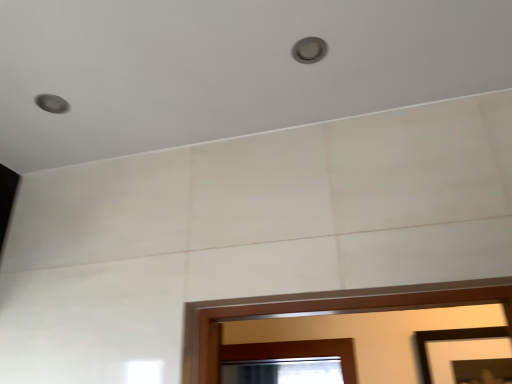
Question: Can you confirm if black matte picture frame at lower right is thinner than matte silver light at upper center?

Choices:
 (A) no
 (B) yes

Answer: (B)

Question: Is black matte picture frame at lower right facing away from matte silver light at upper center?

Choices:
 (A) yes
 (B) no

Answer: (B)

Question: Is black matte picture frame at lower right placed right next to matte silver light at upper center?

Choices:
 (A) no
 (B) yes

Answer: (A)

Question: Is black matte picture frame at lower right facing towards matte silver light at upper center?

Choices:
 (A) yes
 (B) no

Answer: (A)

Question: Does black matte picture frame at lower right lie behind matte silver light at upper center?

Choices:
 (A) yes
 (B) no

Answer: (A)

Question: From the image's perspective, is black matte picture frame at lower right under matte silver light at upper center?

Choices:
 (A) yes
 (B) no

Answer: (A)

Question: Considering the relative sizes of matte silver light at upper center and black matte picture frame at lower right in the image provided, is matte silver light at upper center taller than black matte picture frame at lower right?

Choices:
 (A) no
 (B) yes

Answer: (A)

Question: Can you confirm if matte silver light at upper center is bigger than black matte picture frame at lower right?

Choices:
 (A) no
 (B) yes

Answer: (A)

Question: Can you confirm if matte silver light at upper center is wider than black matte picture frame at lower right?

Choices:
 (A) no
 (B) yes

Answer: (B)

Question: From the image's perspective, is matte silver light at upper center located beneath black matte picture frame at lower right?

Choices:
 (A) yes
 (B) no

Answer: (B)

Question: From the image's perspective, is matte silver light at upper center on top of black matte picture frame at lower right?

Choices:
 (A) no
 (B) yes

Answer: (B)

Question: Is the surface of matte silver light at upper center in direct contact with black matte picture frame at lower right?

Choices:
 (A) no
 (B) yes

Answer: (A)

Question: From their relative heights in the image, would you say black matte picture frame at lower right is taller or shorter than matte silver light at upper center?

Choices:
 (A) short
 (B) tall

Answer: (B)